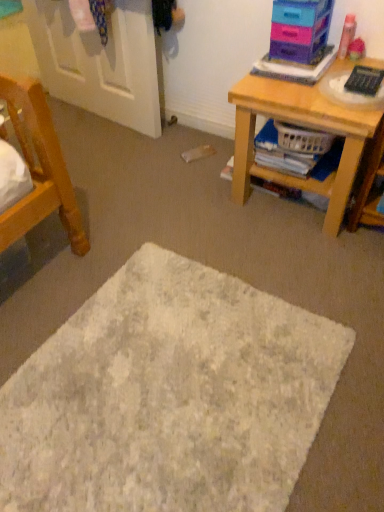
Question: Considering their positions, is white painted wood door at upper left located in front of or behind plastic storage drawers at upper right?

Choices:
 (A) behind
 (B) front

Answer: (A)

Question: From a real-world perspective, is white painted wood door at upper left physically located above or below plastic storage drawers at upper right?

Choices:
 (A) above
 (B) below

Answer: (B)

Question: Which object is positioned closest to the plastic basket at lower right?

Choices:
 (A) plastic storage drawers at upper right
 (B) white painted wood door at upper left
 (C) white textured mat at center
 (D) black plastic remote control at upper right
 (E) wooden desk at right

Answer: (E)

Question: Considering the real-world distances, which object is closest to the plastic storage drawers at upper right?

Choices:
 (A) white textured mat at center
 (B) plastic basket at lower right
 (C) wooden desk at right
 (D) white painted wood door at upper left
 (E) black plastic remote control at upper right

Answer: (E)